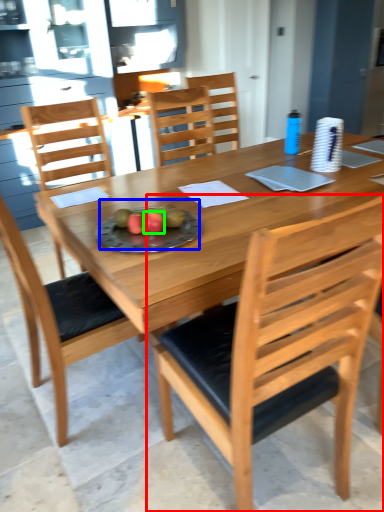
Question: Which object is the farthest from chair (highlighted by a red box)? Choose among these: fruit dish (highlighted by a blue box) or fruit (highlighted by a green box).

Choices:
 (A) fruit dish
 (B) fruit

Answer: (B)